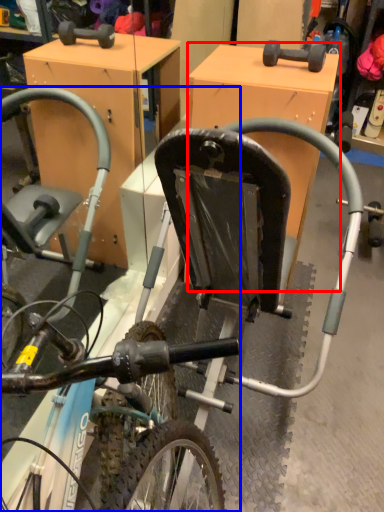
Question: Which point is further to the camera, table (highlighted by a red box) or bicycle (highlighted by a blue box)?

Choices:
 (A) table
 (B) bicycle

Answer: (A)